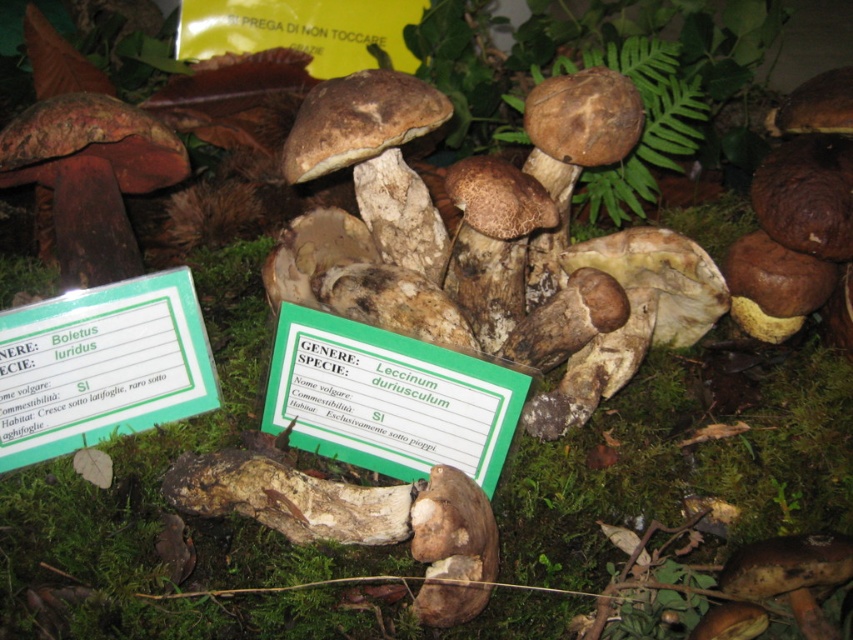
Question: Is green paper sign at center to the left of green paper sign at lower left from the viewer's perspective?

Choices:
 (A) yes
 (B) no

Answer: (B)

Question: Can you confirm if green paper sign at center is bigger than green paper sign at lower left?

Choices:
 (A) yes
 (B) no

Answer: (B)

Question: Can you confirm if green paper sign at center is positioned to the left of green paper sign at lower left?

Choices:
 (A) yes
 (B) no

Answer: (B)

Question: Which of the following is the farthest from the observer?

Choices:
 (A) green paper sign at lower left
 (B) green leafy fern at upper center

Answer: (B)

Question: Which object appears closest to the camera in this image?

Choices:
 (A) green paper sign at lower left
 (B) green leafy fern at upper center

Answer: (A)

Question: Among these points, which one is farthest from the camera?

Choices:
 (A) (653, 100)
 (B) (380, 355)

Answer: (A)